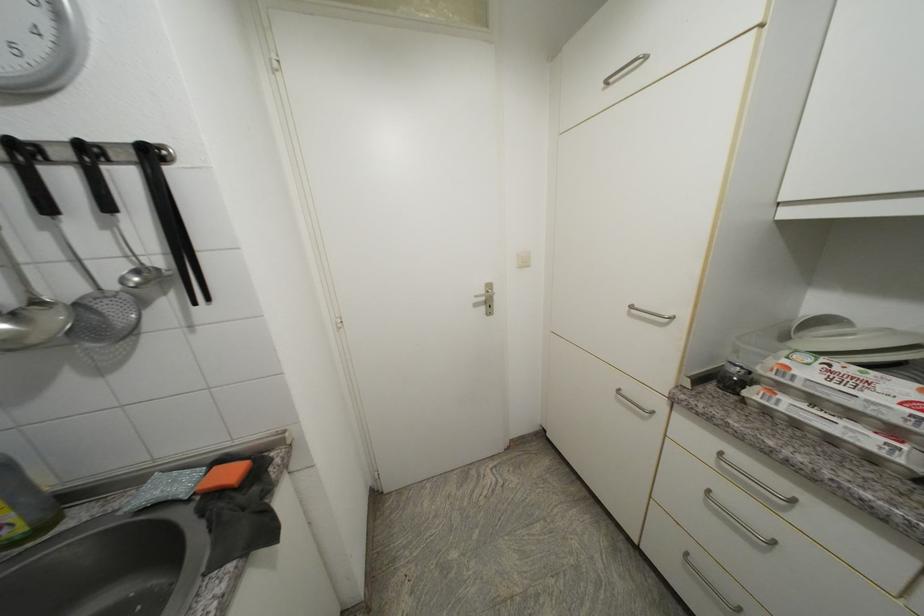
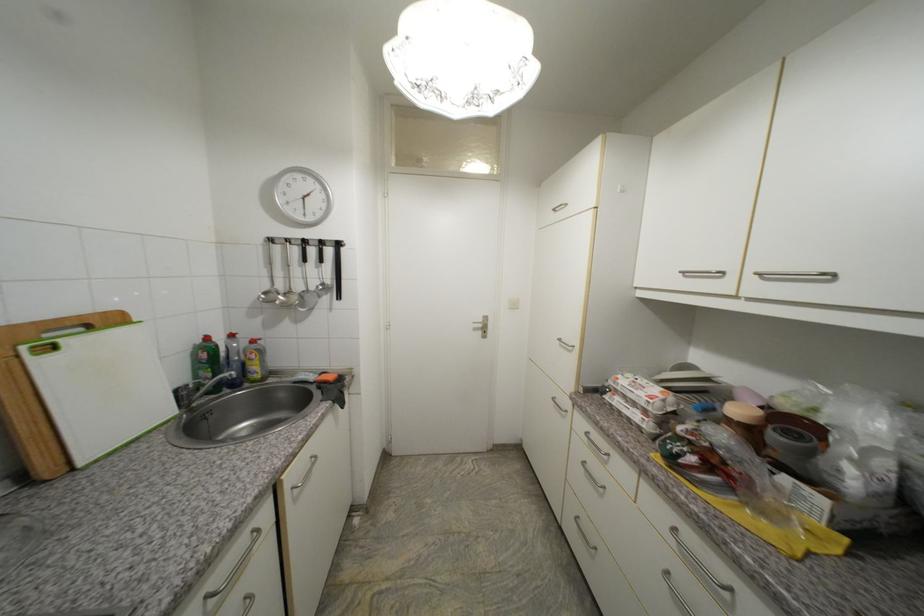
Question: The camera is either moving clockwise (left) or counter-clockwise (right) around the object. The first image is from the beginning of the video and the second image is from the end. Is the camera moving left or right when shooting the video?

Choices:
 (A) Left
 (B) Right

Answer: (B)